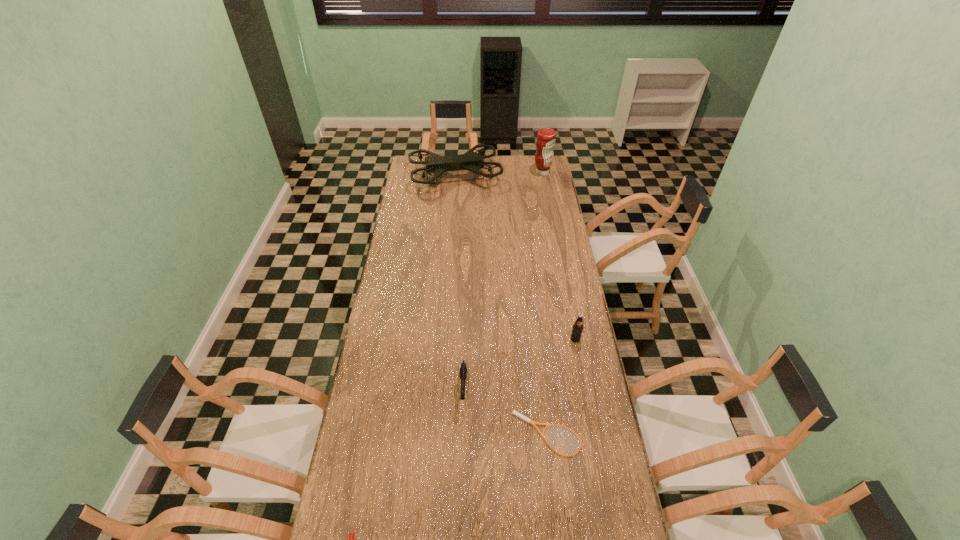
Where is `object positioned at the far right corner`? The height and width of the screenshot is (540, 960). object positioned at the far right corner is located at coordinates (546, 139).

What are the coordinates of `vacant point at the far edge` in the screenshot? It's located at (509, 173).

Where is `free space at the left edge of the desktop`? The height and width of the screenshot is (540, 960). free space at the left edge of the desktop is located at coordinates (407, 179).

Where is `vacant space at the right edge of the desktop`? The image size is (960, 540). vacant space at the right edge of the desktop is located at coordinates (542, 272).

Image resolution: width=960 pixels, height=540 pixels. Find the location of `unoccupied position between the drone and the pop`. unoccupied position between the drone and the pop is located at coordinates (516, 257).

Identify the location of free space between the farther tennis racket and the drone. (502, 305).

What are the coordinates of `empty space between the third shortest object and the drone` in the screenshot? It's located at (460, 281).

Find the location of `empty space between the fourth farthest object and the farther tennis racket`. empty space between the fourth farthest object and the farther tennis racket is located at coordinates (506, 411).

Identify the location of vacant space that is in between the second nearest object and the fourth nearest object. Image resolution: width=960 pixels, height=540 pixels. (562, 387).

Identify the location of the second closest object to the drone. This screenshot has height=540, width=960. (577, 329).